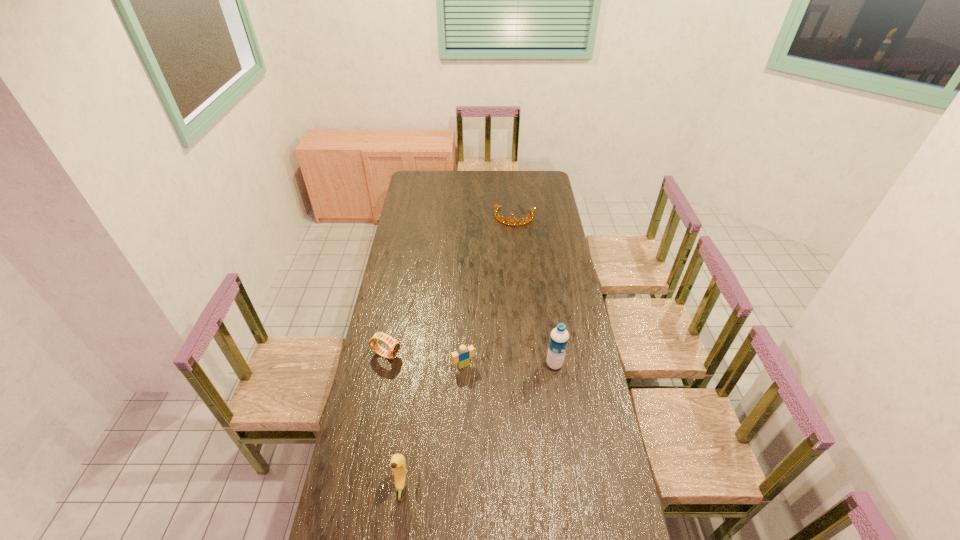
Locate an element on the screen. free space at the left edge is located at coordinates (398, 240).

Image resolution: width=960 pixels, height=540 pixels. In the image, there is a desktop. What are the coordinates of `vacant space at the right edge` in the screenshot? It's located at (540, 244).

Find the location of `vacant space at the far left corner of the desktop`. vacant space at the far left corner of the desktop is located at coordinates (409, 186).

In the image, there is a desktop. Identify the location of free space at the near left corner. (348, 523).

Identify the location of free space at the far right corner of the desktop. (545, 183).

You are a GUI agent. You are given a task and a screenshot of the screen. Output one action in this format:
    pyautogui.click(x=<x>, y=<y>)
    Task: Click on the vacant area that lies between the leftmost object and the fourth shortest object
    The image size is (960, 540).
    Given the screenshot: What is the action you would take?
    pyautogui.click(x=394, y=421)

Locate an element on the screen. free spot between the leftmost object and the Lego is located at coordinates (425, 360).

This screenshot has height=540, width=960. Identify the location of vacant point located between the Lego and the shortest object. (489, 291).

Identify the location of free space that is in between the leftmost object and the water bottle. The height and width of the screenshot is (540, 960). (470, 360).

Locate an element on the screen. free point between the nearest object and the third object from left to right is located at coordinates (432, 426).